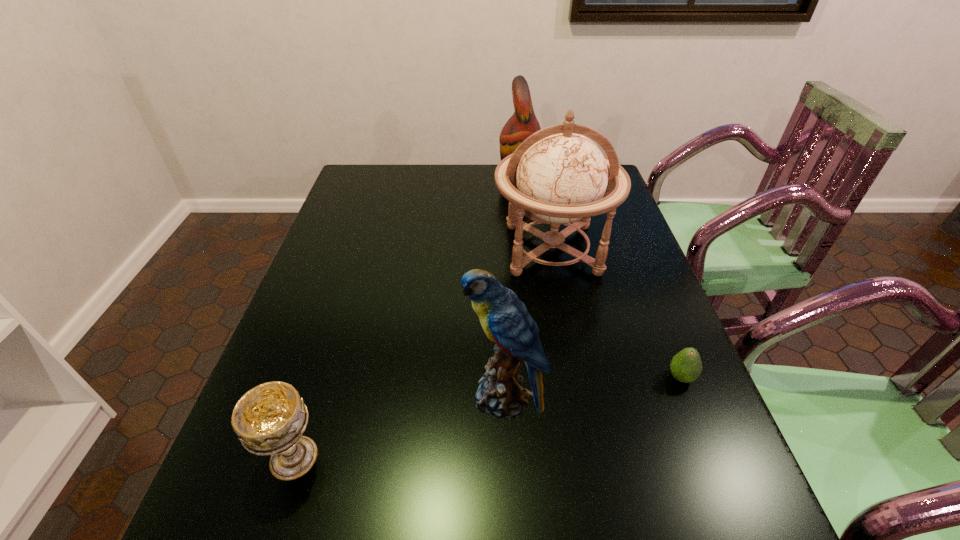
Locate an element on the screen. This screenshot has height=540, width=960. avocado located at the right edge is located at coordinates (686, 366).

At what (x,y) coordinates should I click in order to perform the action: click on vacant area at the far edge of the desktop. Please return your answer as a coordinate pair (x, y). The height and width of the screenshot is (540, 960). Looking at the image, I should click on (473, 174).

Identify the location of vacant space at the near edge of the desktop. (557, 521).

Where is `vacant space at the left edge of the desktop`? The width and height of the screenshot is (960, 540). vacant space at the left edge of the desktop is located at coordinates (311, 323).

Identify the location of vacant point at the right edge. The image size is (960, 540). pos(638,407).

Locate an element on the screen. vacant space at the far left corner of the desktop is located at coordinates (351, 182).

Where is `free space between the nearer parrot and the nearest object`? This screenshot has width=960, height=540. free space between the nearer parrot and the nearest object is located at coordinates (398, 427).

Where is `free space between the second farthest object and the leftmost object`? This screenshot has width=960, height=540. free space between the second farthest object and the leftmost object is located at coordinates pyautogui.click(x=423, y=354).

Where is `blank region between the farthest object and the avocado`? This screenshot has height=540, width=960. blank region between the farthest object and the avocado is located at coordinates (601, 278).

At what (x,y) coordinates should I click in order to perform the action: click on blank region between the second shortest object and the nearer parrot. Please return your answer as a coordinate pair (x, y). The width and height of the screenshot is (960, 540). Looking at the image, I should click on (398, 427).